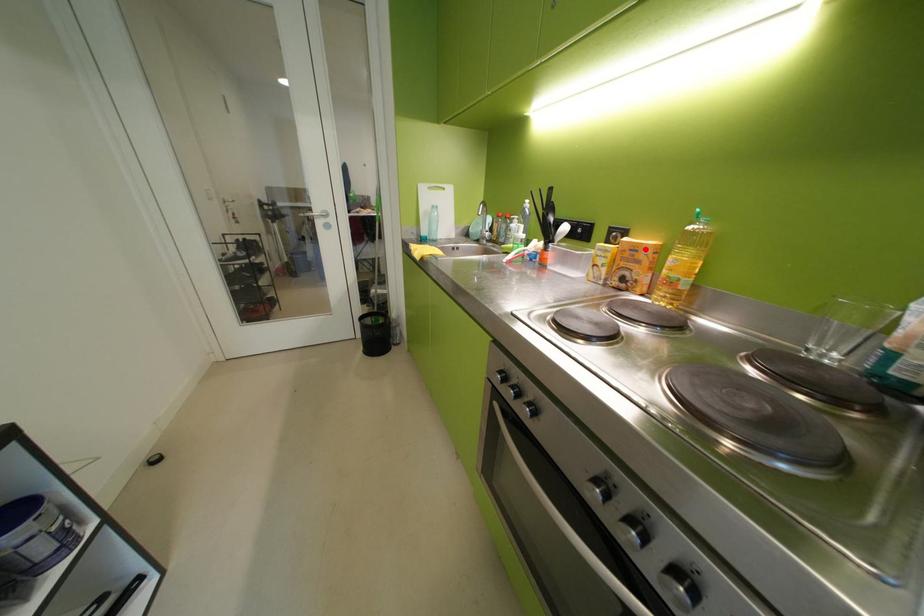
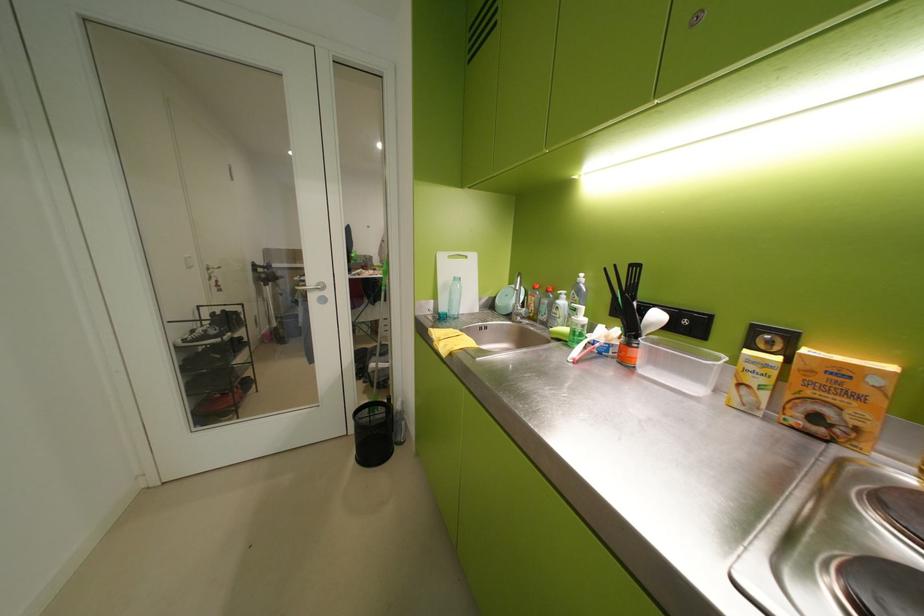
The point at the highlighted location is marked in the first image. Where is the corresponding point in the second image?

(852, 373)